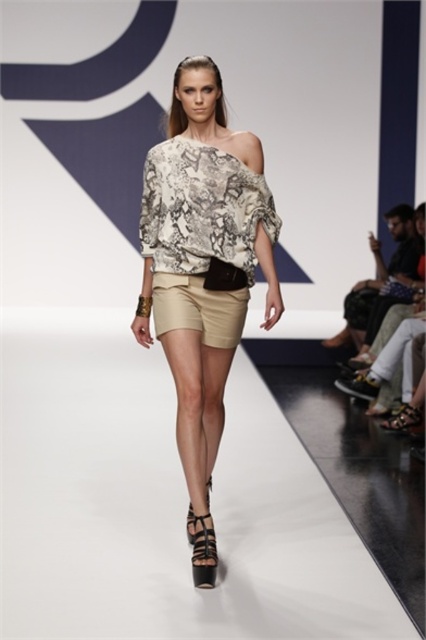
You are a fashion designer observing the runway show. You need to determine if the beige cotton shorts at center can be paired with the leather textured sandal at lower right in terms of width. Which one is wider?

The beige cotton shorts at center might be wider than leather textured sandal at lower right.